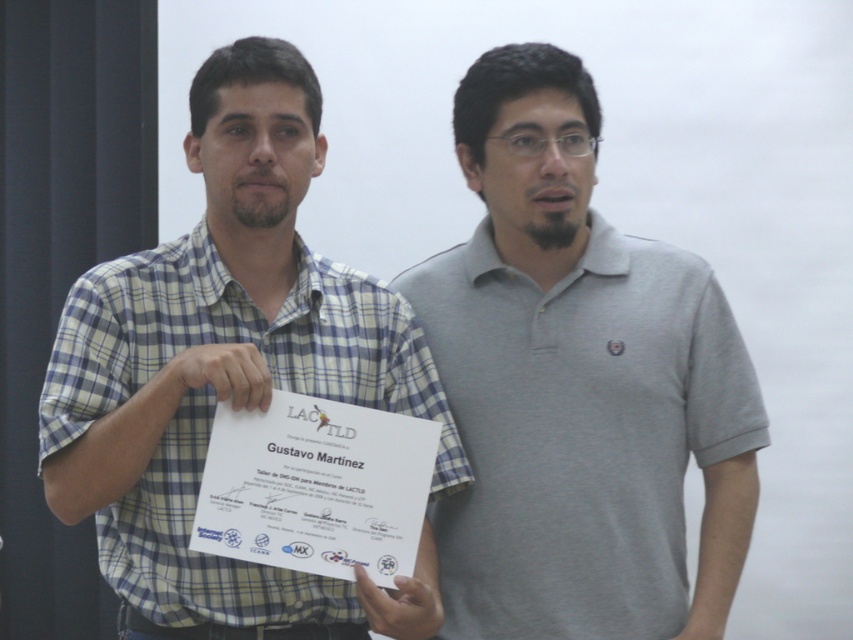
Question: Can you confirm if gray cotton polo shirt at center is positioned to the right of checkered fabric shirt at center?

Choices:
 (A) no
 (B) yes

Answer: (B)

Question: Which point is closer to the camera?

Choices:
 (A) (721, 340)
 (B) (160, 496)

Answer: (B)

Question: Can you confirm if gray cotton polo shirt at center is positioned to the right of checkered fabric shirt at center?

Choices:
 (A) yes
 (B) no

Answer: (A)

Question: Among these points, which one is farthest from the camera?

Choices:
 (A) (138, 445)
 (B) (523, 344)

Answer: (B)

Question: Does gray cotton polo shirt at center appear under checkered fabric shirt at center?

Choices:
 (A) no
 (B) yes

Answer: (B)